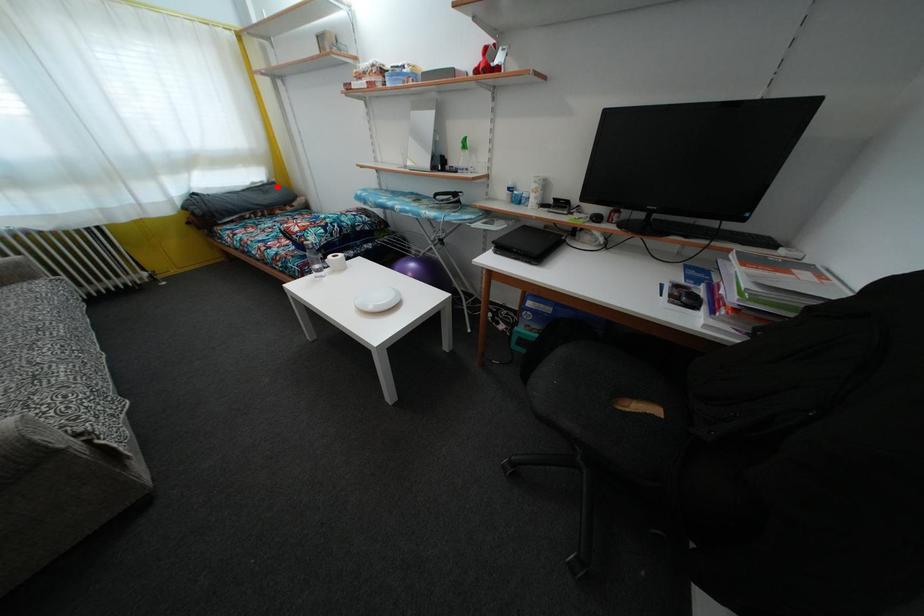
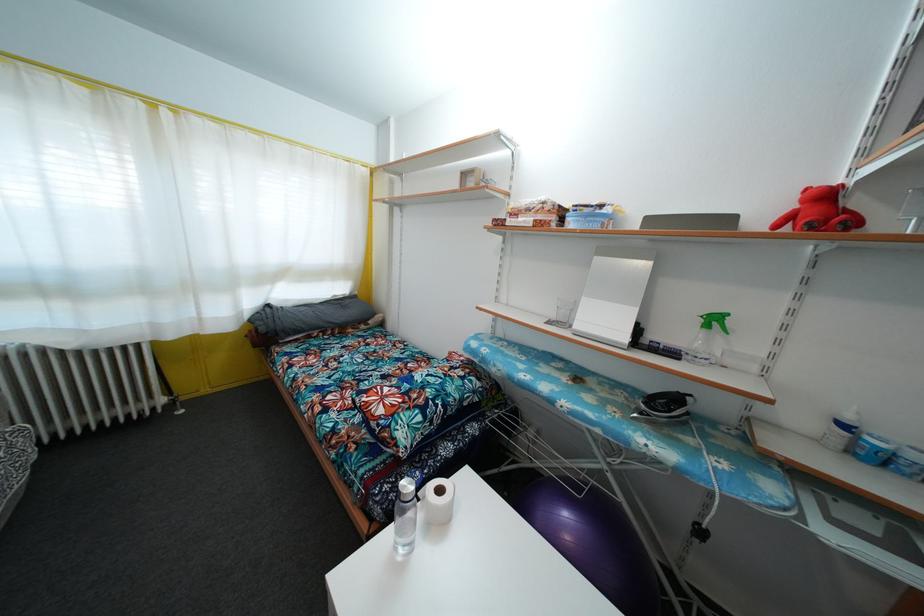
Find the pixel in the second image that matches the highlighted location in the first image.

(359, 300)